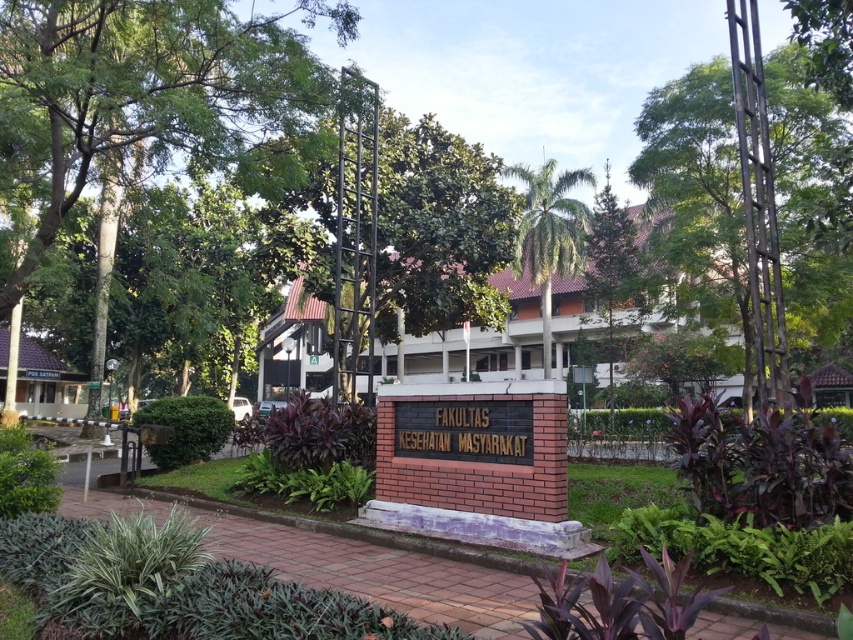
Question: Which of the following is the closest to the observer?

Choices:
 (A) green leafy palm tree at center
 (B) green leafy tree at upper right

Answer: (B)

Question: Which point is farther to the camera?

Choices:
 (A) (0, 298)
 (B) (424, 193)

Answer: (B)

Question: In this image, where is brown brick building at center located relative to white painted wood hotel at lower left?

Choices:
 (A) above
 (B) below

Answer: (A)

Question: Which object is closer to the camera taking this photo?

Choices:
 (A) green leafy tree at upper center
 (B) green leafy tree at upper right
 (C) green leafy tree at upper left
 (D) white painted wood hotel at lower left

Answer: (B)

Question: Does green leafy tree at upper left have a greater width compared to green leafy tree at upper right?

Choices:
 (A) no
 (B) yes

Answer: (A)

Question: Does green leafy tree at upper left appear on the right side of green leafy tree at center?

Choices:
 (A) yes
 (B) no

Answer: (B)